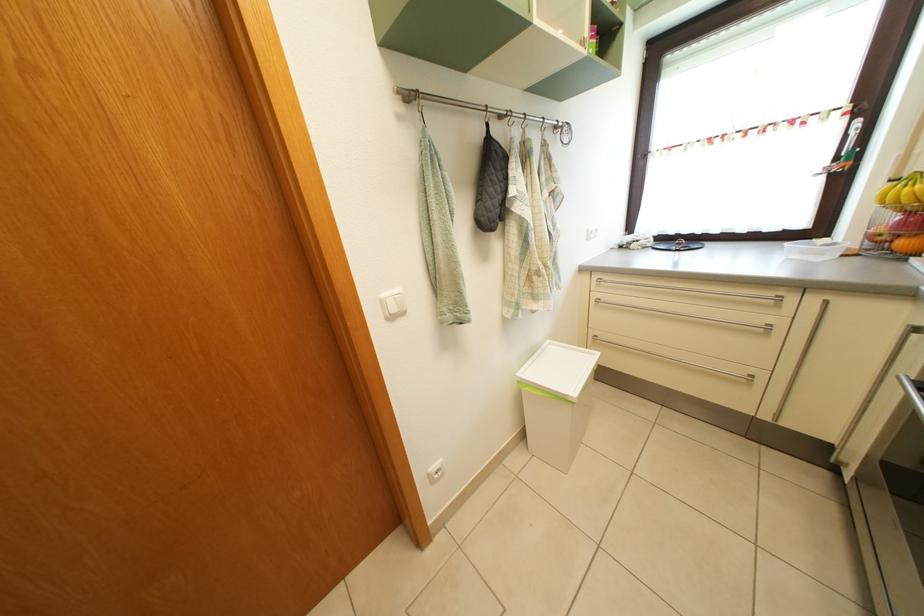
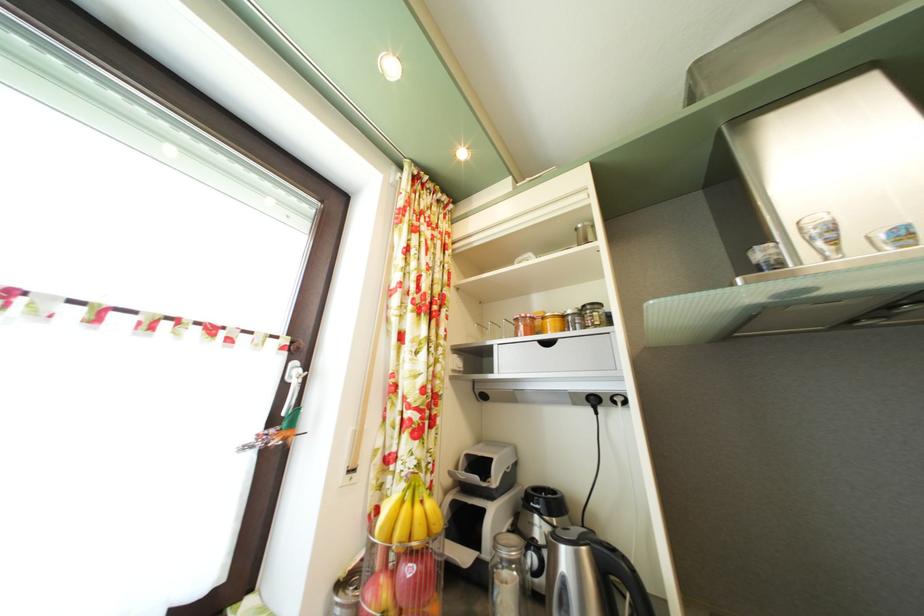
The point at (867, 128) is marked in the first image. Where is the corresponding point in the second image?

(304, 371)